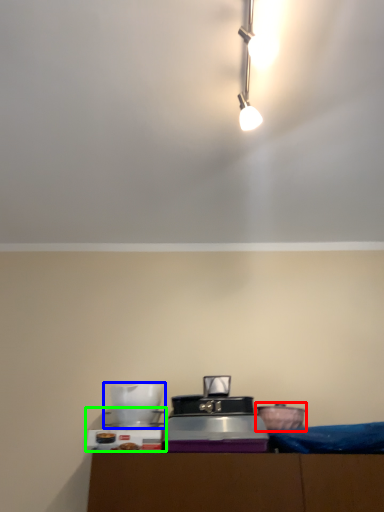
Question: Based on their relative distances, which object is farther from appliance (highlighted by a red box)? Choose from appliance (highlighted by a blue box) and appliance (highlighted by a green box).

Choices:
 (A) appliance
 (B) appliance

Answer: (B)